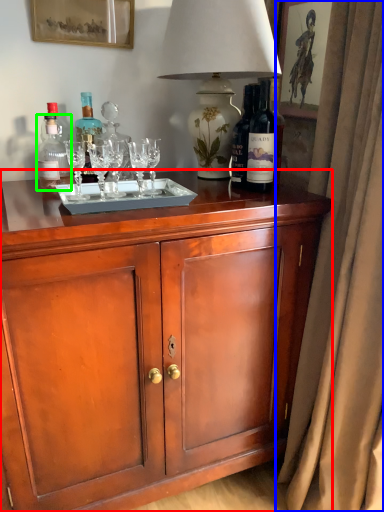
Question: Which is farther away from cabinetry (highlighted by a red box)? curtain (highlighted by a blue box) or bottle (highlighted by a green box)?

Choices:
 (A) curtain
 (B) bottle

Answer: (B)